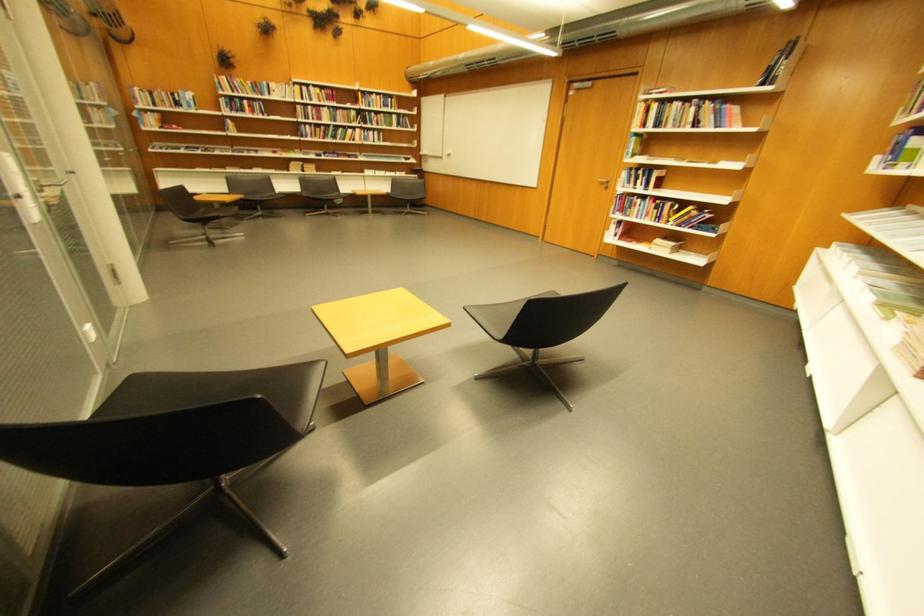
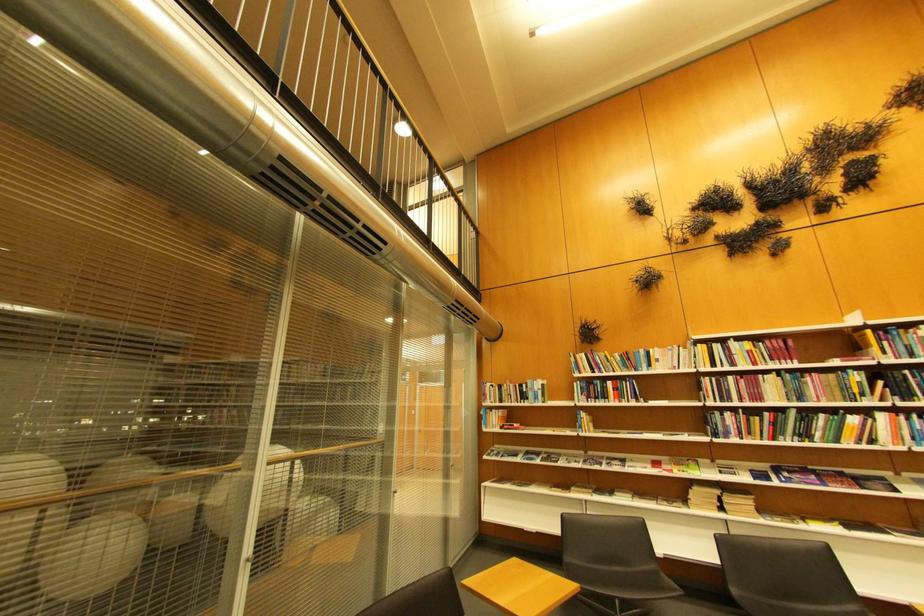
Where in the second image is the point corresponding to (x=320, y=108) from the first image?

(740, 379)